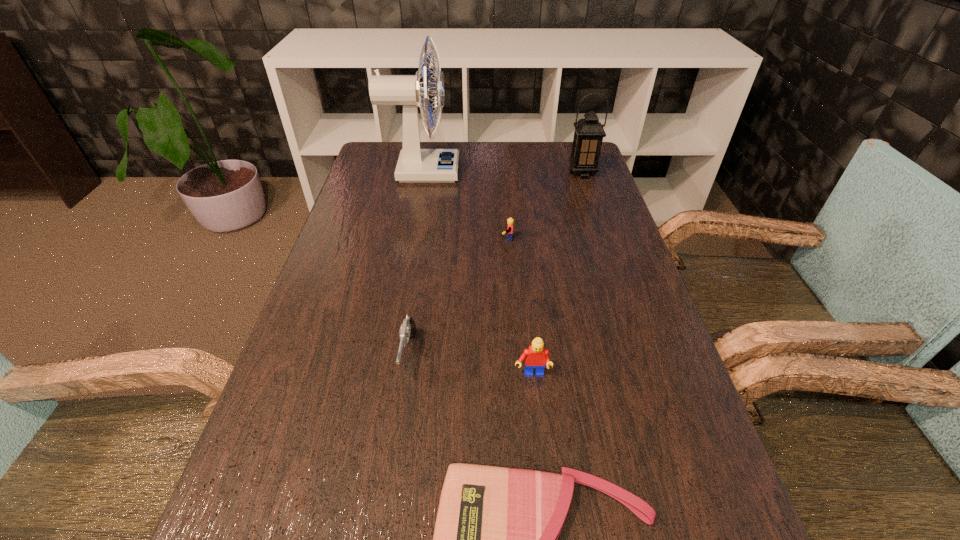
I want to click on vacant space located on the front-facing side of the fourth nearest object, so click(x=436, y=239).

Locate an element on the screen. The width and height of the screenshot is (960, 540). vacant position located 0.310m on the front-facing side of the fourth nearest object is located at coordinates 375,239.

Identify the location of free space located 0.250m at the muzzle of the gun. This screenshot has height=540, width=960. (382, 532).

I want to click on fan situated at the far edge, so click(415, 164).

In order to click on lantern that is at the far edge in this screenshot , I will do `click(588, 136)`.

Locate an element on the screen. Image resolution: width=960 pixels, height=540 pixels. object that is at the left edge is located at coordinates (415, 164).

What are the coordinates of `object that is positioned at the right edge` in the screenshot? It's located at (588, 136).

The image size is (960, 540). In order to click on object present at the far left corner in this screenshot , I will do tap(415, 164).

Find the location of a particular element. The height and width of the screenshot is (540, 960). object at the far right corner is located at coordinates (588, 136).

Identify the location of vacant space at the far edge of the desktop. Image resolution: width=960 pixels, height=540 pixels. (473, 164).